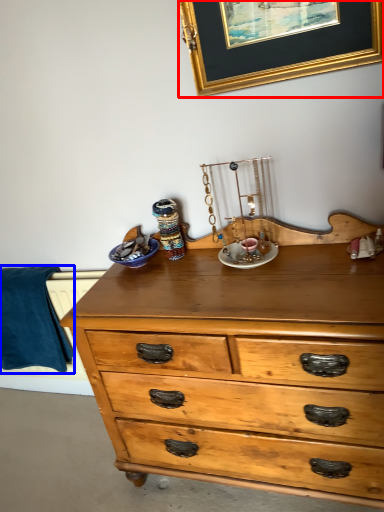
Question: Which object is further to the camera taking this photo, picture frame (highlighted by a red box) or blanket (highlighted by a blue box)?

Choices:
 (A) picture frame
 (B) blanket

Answer: (B)